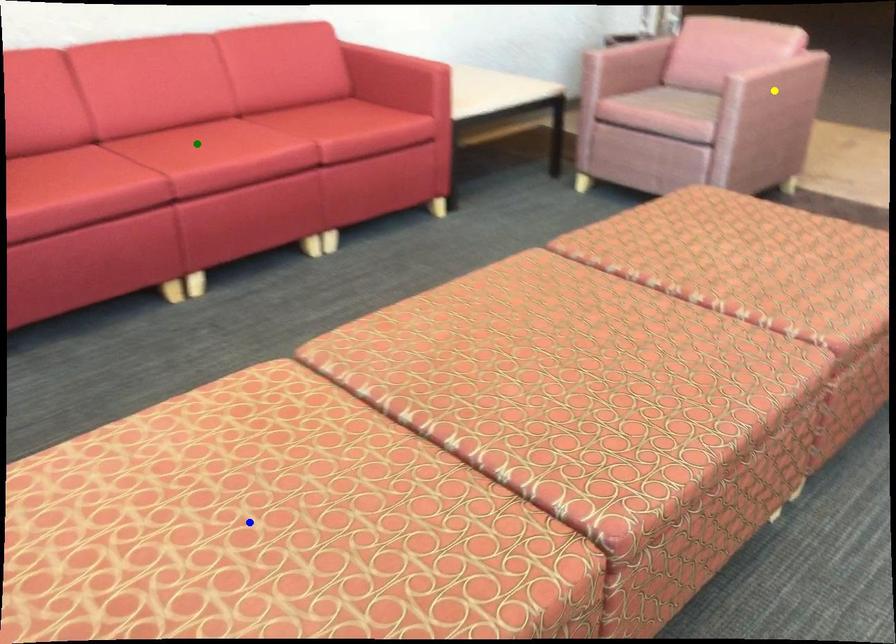
Order these from farthest to nearest:
1. blue point
2. green point
3. yellow point

yellow point, green point, blue point